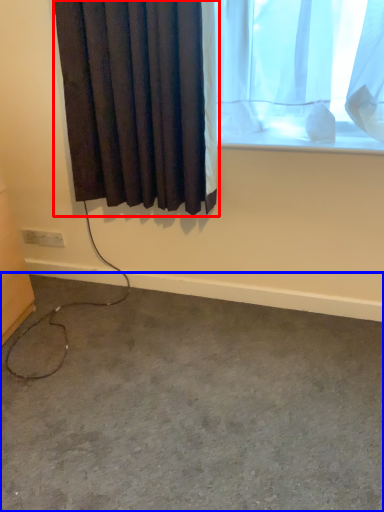
Question: Which of the following is the closest to the observer, curtain (highlighted by a red box) or concrete (highlighted by a blue box)?

Choices:
 (A) curtain
 (B) concrete

Answer: (B)